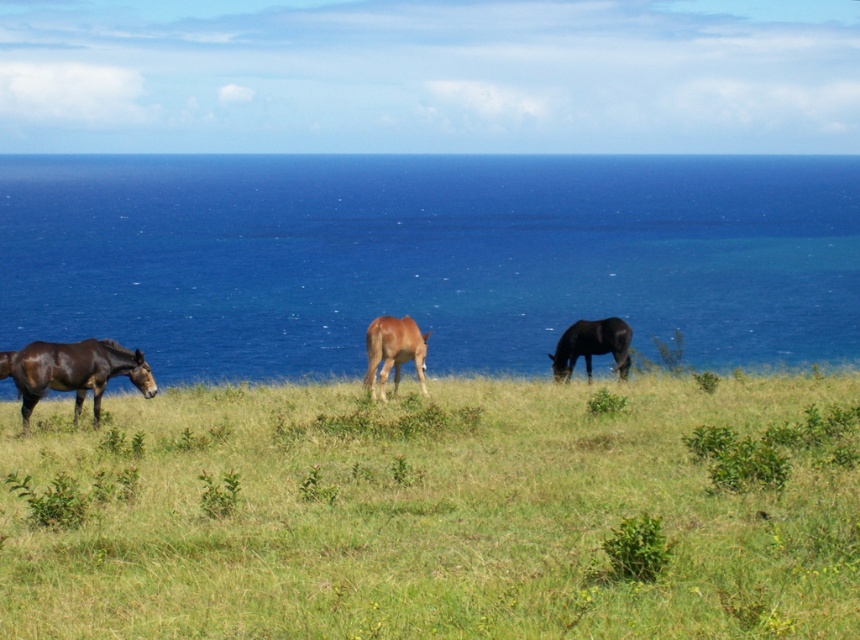
You are a photographer wanting to capture the shiny brown horse at left and the brown matte horse at center in a single frame. Given that your camera has a fixed focal length, which horse would appear bigger in the photo?

The shiny brown horse at left would appear bigger in the photo because it has a larger size compared to the brown matte horse at center.